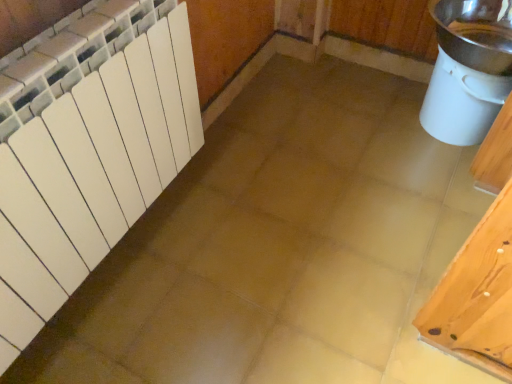
Where is `white matte radiator at left`? white matte radiator at left is located at coordinates (87, 149).

This screenshot has height=384, width=512. Describe the element at coordinates (87, 149) in the screenshot. I see `white matte radiator at left` at that location.

What do you see at coordinates (468, 69) in the screenshot? This screenshot has width=512, height=384. I see `white plastic bucket at right` at bounding box center [468, 69].

Image resolution: width=512 pixels, height=384 pixels. In order to click on white plastic bucket at right in this screenshot , I will do `click(468, 69)`.

Identify the location of white matte radiator at left. The image size is (512, 384). (87, 149).

In the scene shown: Considering the relative positions of white matte radiator at left and white plastic bucket at right in the image provided, is white matte radiator at left to the left of white plastic bucket at right from the viewer's perspective?

Yes, white matte radiator at left is to the left of white plastic bucket at right.

Is white matte radiator at left in front of or behind white plastic bucket at right in the image?

white matte radiator at left is positioned closer to the viewer than white plastic bucket at right.

Is point (2, 371) closer to camera compared to point (434, 109)?

Yes, it is in front of point (434, 109).

From the image's perspective, would you say white matte radiator at left is positioned over white plastic bucket at right?

No, from the image's perspective, white matte radiator at left is not on top of white plastic bucket at right.

From the picture: From a real-world perspective, is white matte radiator at left above or below white plastic bucket at right?

white matte radiator at left is situated higher than white plastic bucket at right in the real world.

Which object is wider, white matte radiator at left or white plastic bucket at right?

With larger width is white plastic bucket at right.

In terms of height, does white matte radiator at left look taller or shorter compared to white plastic bucket at right?

Considering their sizes, white matte radiator at left has more height than white plastic bucket at right.

Which of these two, white matte radiator at left or white plastic bucket at right, is smaller?

white plastic bucket at right.

Is white plastic bucket at right surrounded by white matte radiator at left?

No, white plastic bucket at right is not a part of white matte radiator at left.

Does white matte radiator at left touch white plastic bucket at right?

There is a gap between white matte radiator at left and white plastic bucket at right.

Is white matte radiator at left aimed at white plastic bucket at right?

No, white matte radiator at left is not oriented towards white plastic bucket at right.

Can you tell me how much white matte radiator at left and white plastic bucket at right differ in facing direction?

They differ by 84.2 degrees in their facing directions.

The width and height of the screenshot is (512, 384). What are the coordinates of `sink on the right of white matte radiator at left` in the screenshot? It's located at coord(468,69).

Which is more to the right, white plastic bucket at right or white matte radiator at left?

From the viewer's perspective, white plastic bucket at right appears more on the right side.

Which is in front, white plastic bucket at right or white matte radiator at left?

white matte radiator at left.

Which point is more forward, [451,116] or [77,189]?

Point [77,189]

Looking at this image, from the image's perspective, would you say white plastic bucket at right is shown under white matte radiator at left?

Actually, white plastic bucket at right appears above white matte radiator at left in the image.

From a real-world perspective, is white plastic bucket at right positioned over white matte radiator at left based on gravity?

No, from a real-world perspective, white plastic bucket at right is not above white matte radiator at left.

Considering the relative sizes of white plastic bucket at right and white matte radiator at left in the image provided, is white plastic bucket at right thinner than white matte radiator at left?

No, white plastic bucket at right is not thinner than white matte radiator at left.

Which of these two, white plastic bucket at right or white matte radiator at left, stands taller?

Standing taller between the two is white matte radiator at left.

Does white plastic bucket at right have a smaller size compared to white matte radiator at left?

Correct, white plastic bucket at right occupies less space than white matte radiator at left.

Could white matte radiator at left be considered to be inside white plastic bucket at right?

Definitely not — white matte radiator at left is not inside white plastic bucket at right.

Looking at this image, are white plastic bucket at right and white matte radiator at left beside each other?

There is a gap between white plastic bucket at right and white matte radiator at left.

Is white matte radiator at left at the back of white plastic bucket at right?

That's not correct — white plastic bucket at right is not looking away from white matte radiator at left.

From the picture: What's the angular difference between white plastic bucket at right and white matte radiator at left's facing directions?

There is a 84.2-degree angle between the facing directions of white plastic bucket at right and white matte radiator at left.

Where is `sink above the white matte radiator at left (from the image's perspective)`? This screenshot has width=512, height=384. sink above the white matte radiator at left (from the image's perspective) is located at coordinates tap(468, 69).

At what (x,y) coordinates should I click in order to perform the action: click on radiator located above the white plastic bucket at right (from a real-world perspective). Please return your answer as a coordinate pair (x, y). The image size is (512, 384). Looking at the image, I should click on (87, 149).

Locate an element on the screen. The height and width of the screenshot is (384, 512). sink behind the white matte radiator at left is located at coordinates (468, 69).